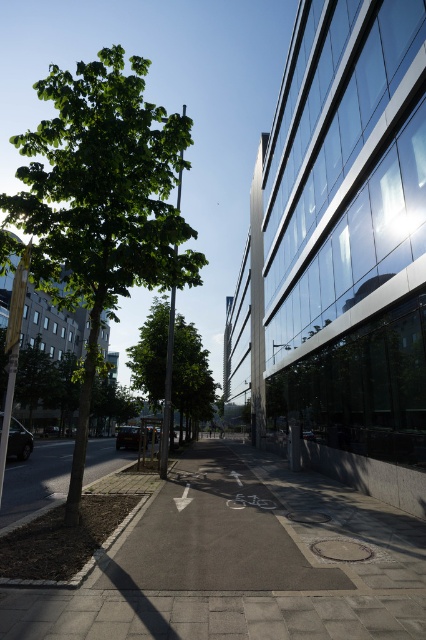
Who is higher up, green leafy tree at left or green leafy tree at center?

green leafy tree at left is above.

Does green leafy tree at left appear under green leafy tree at center?

No.

Does point (149, 145) come in front of point (175, 365)?

Yes, it is.

Find the location of a particular element. This screenshot has height=640, width=426. green leafy tree at left is located at coordinates (101, 204).

Which is more to the left, gray asphalt at center or green leafy tree at left?

Positioned to the left is green leafy tree at left.

Does gray asphalt at center have a greater width compared to green leafy tree at left?

No, gray asphalt at center is not wider than green leafy tree at left.

Between point (420, 529) and point (152, 128), which one is positioned behind?

The point (152, 128) is more distant.

The height and width of the screenshot is (640, 426). In order to click on gray asphalt at center in this screenshot , I will do `click(241, 563)`.

Is gray asphalt at center shorter than green leafy tree at center?

Yes, gray asphalt at center is shorter than green leafy tree at center.

Describe the element at coordinates (241, 563) in the screenshot. The image size is (426, 640). I see `gray asphalt at center` at that location.

Is point (422, 589) in front of point (204, 397)?

Yes, point (422, 589) is closer to viewer.

Where is `gray asphalt at center`? gray asphalt at center is located at coordinates (241, 563).